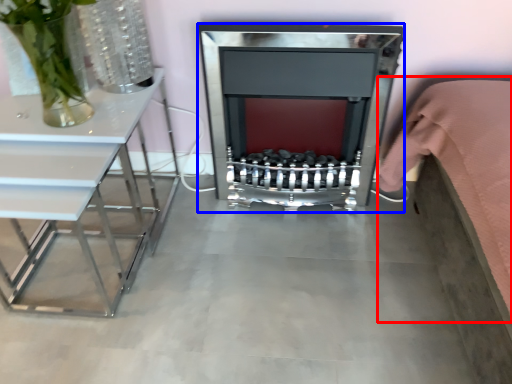
Question: Which of the following is the closest to the observer, bed (highlighted by a red box) or fireplace (highlighted by a blue box)?

Choices:
 (A) bed
 (B) fireplace

Answer: (A)